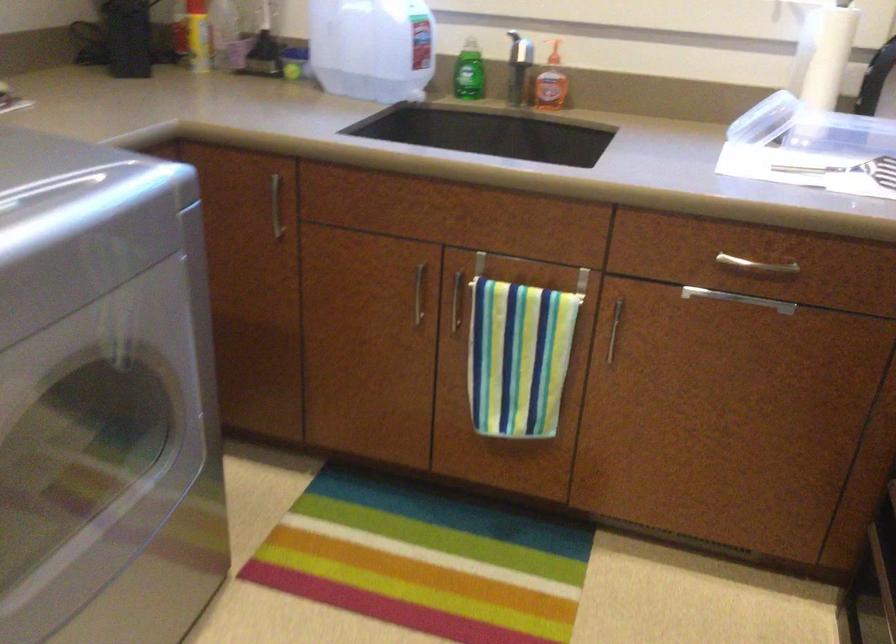
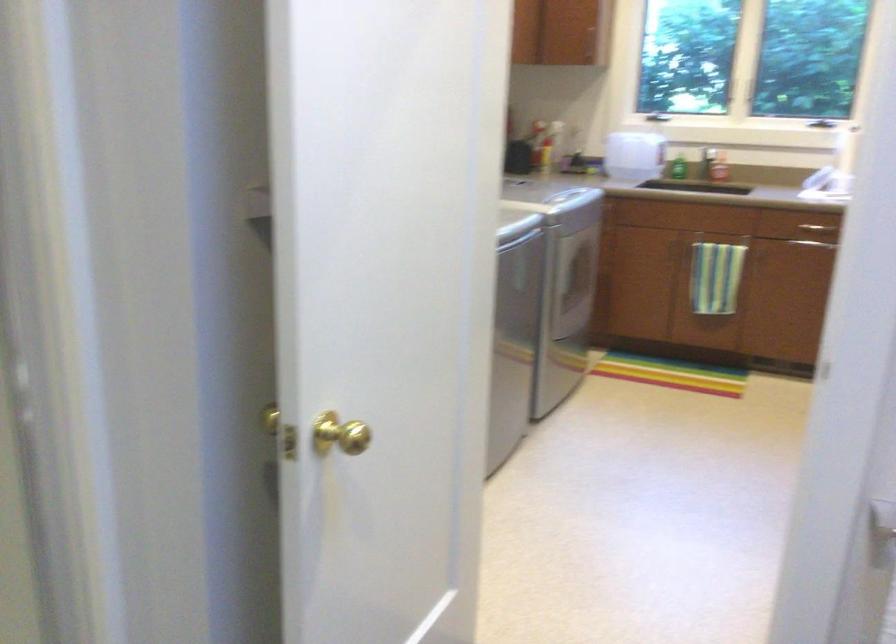
Question: Which direction would the cameraman need to move to produce the second image? Reply with the corresponding letter.

Choices:
 (A) Left
 (B) Right
 (C) Forward
 (D) Backward

Answer: (D)